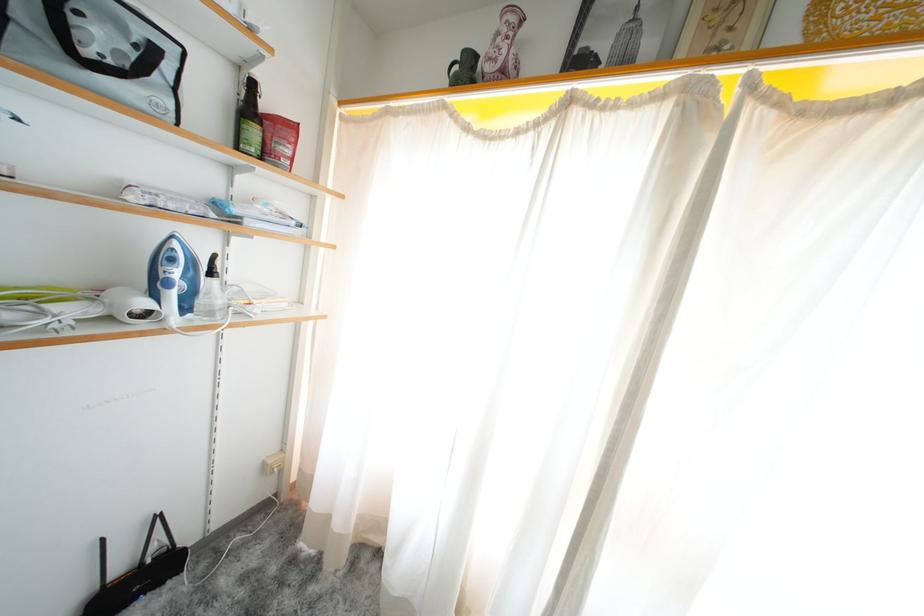
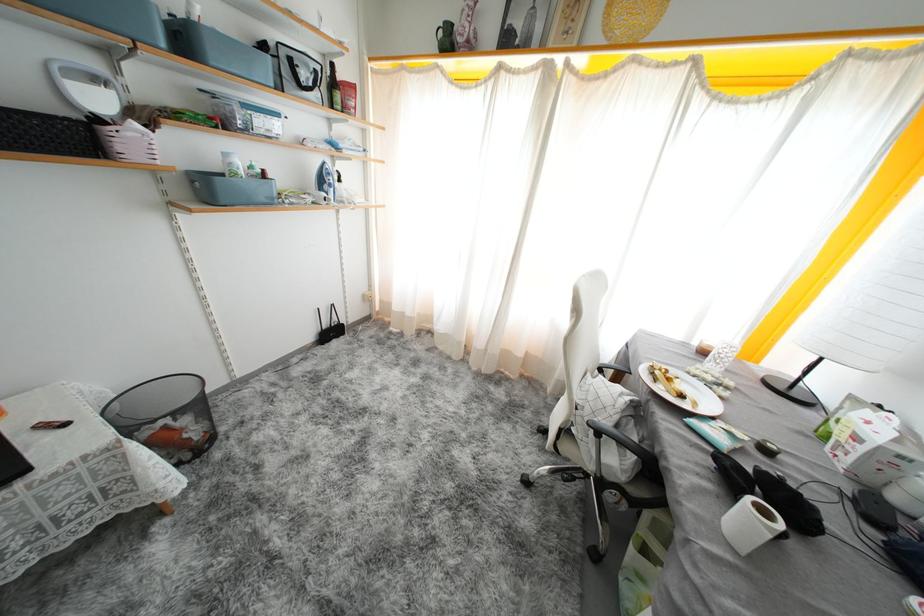
Find the pixel in the second image that matches (462,73) in the first image.

(446, 37)